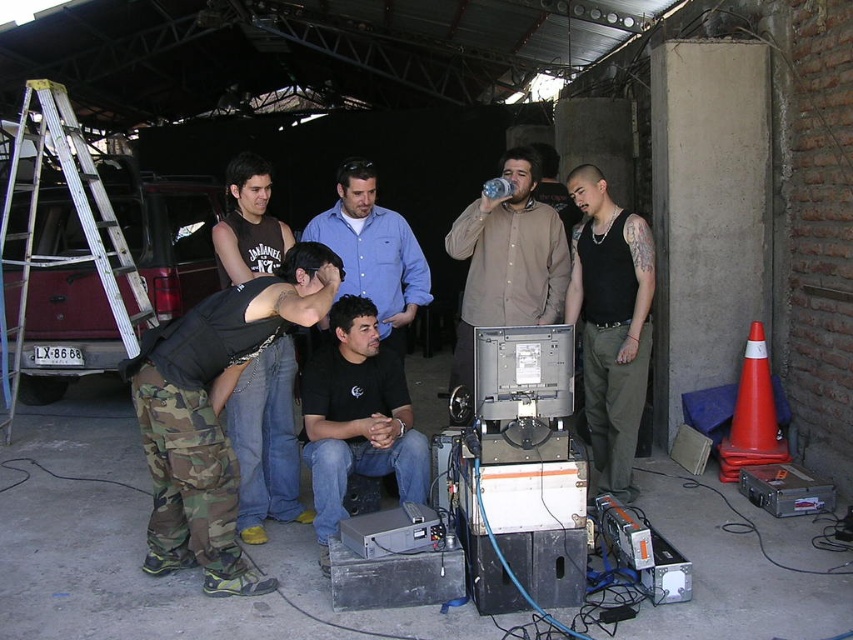
Can you confirm if black matte shirt at center is smaller than blue shirt at center?

Indeed, black matte shirt at center has a smaller size compared to blue shirt at center.

Is point (331, 308) more distant than point (392, 348)?

No, it is in front of (392, 348).

Find the location of a particular element. Image resolution: width=853 pixels, height=640 pixels. black matte shirt at center is located at coordinates (357, 419).

Is camo pants at center bigger than black tank top at center?

Yes.

Between camo pants at center and black tank top at center, which one appears on the right side from the viewer's perspective?

black tank top at center

This screenshot has height=640, width=853. What are the coordinates of `camo pants at center` in the screenshot? It's located at (213, 412).

Is point (216, 241) in front of point (489, 243)?

Yes, it is in front of point (489, 243).

Can you confirm if black leather vest at center is shorter than brown matte shirt at center?

Indeed, black leather vest at center has a lesser height compared to brown matte shirt at center.

Between point (288, 464) and point (560, 243), which one is positioned behind?

The point (560, 243) is behind.

Image resolution: width=853 pixels, height=640 pixels. Find the location of `black leather vest at center`. black leather vest at center is located at coordinates 265,442.